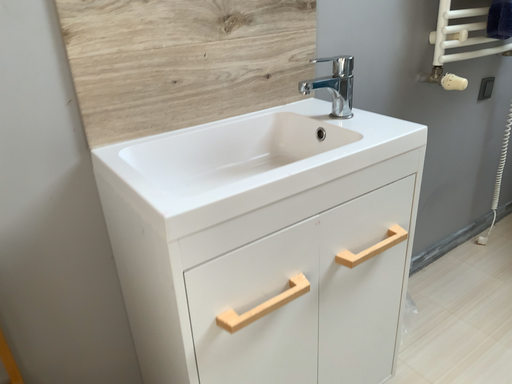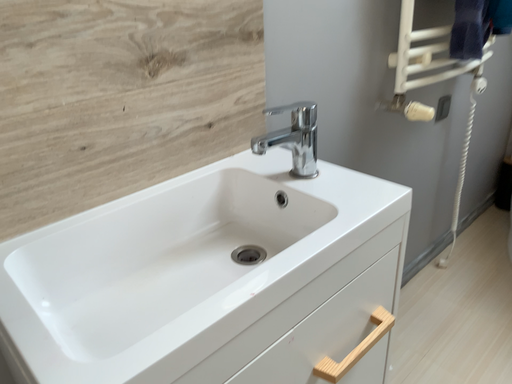
Question: Which way did the camera rotate in the video?

Choices:
 (A) rotated right
 (B) rotated left

Answer: (A)